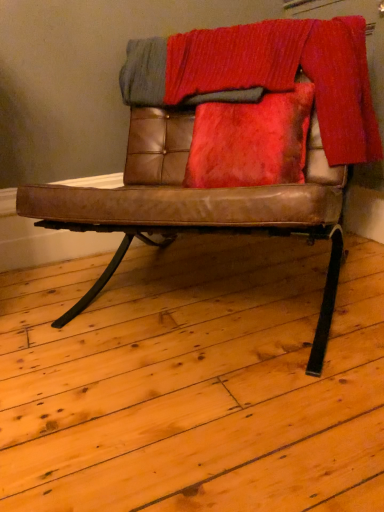
Question: In terms of size, does knitted wool blanket at upper center appear bigger or smaller than brown leather chair at center?

Choices:
 (A) small
 (B) big

Answer: (A)

Question: From the image's perspective, is knitted wool blanket at upper center located above or below brown leather chair at center?

Choices:
 (A) below
 (B) above

Answer: (B)

Question: Looking at their shapes, would you say knitted wool blanket at upper center is wider or thinner than brown leather chair at center?

Choices:
 (A) thin
 (B) wide

Answer: (A)

Question: Looking at the image, does brown leather chair at center seem bigger or smaller compared to knitted wool blanket at upper center?

Choices:
 (A) small
 (B) big

Answer: (B)

Question: Does point (240, 74) appear closer or farther from the camera than point (339, 115)?

Choices:
 (A) closer
 (B) farther

Answer: (B)

Question: From the image's perspective, is brown leather chair at center located above or below knitted wool blanket at upper center?

Choices:
 (A) above
 (B) below

Answer: (B)

Question: Considering the positions of brown leather chair at center and knitted wool blanket at upper center in the image, is brown leather chair at center wider or thinner than knitted wool blanket at upper center?

Choices:
 (A) thin
 (B) wide

Answer: (B)